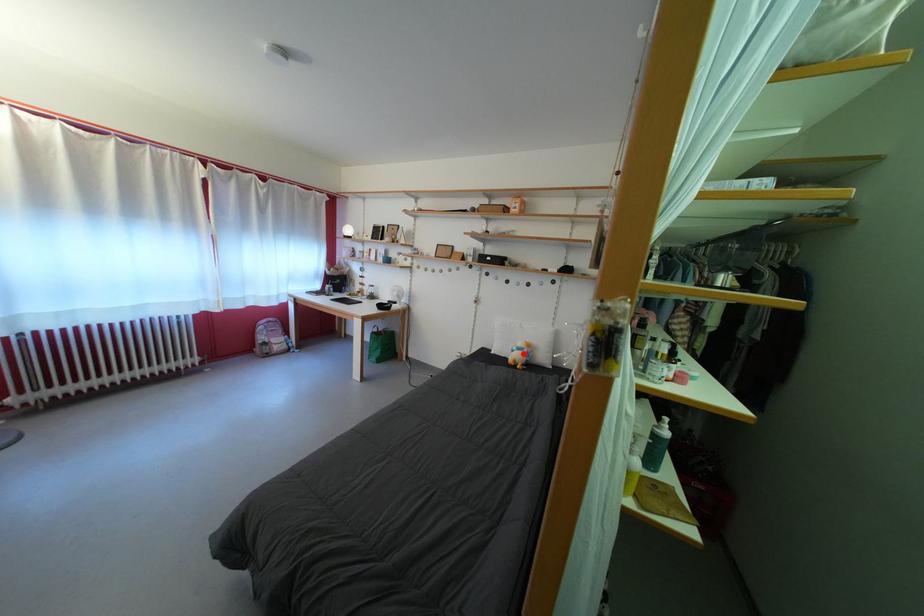
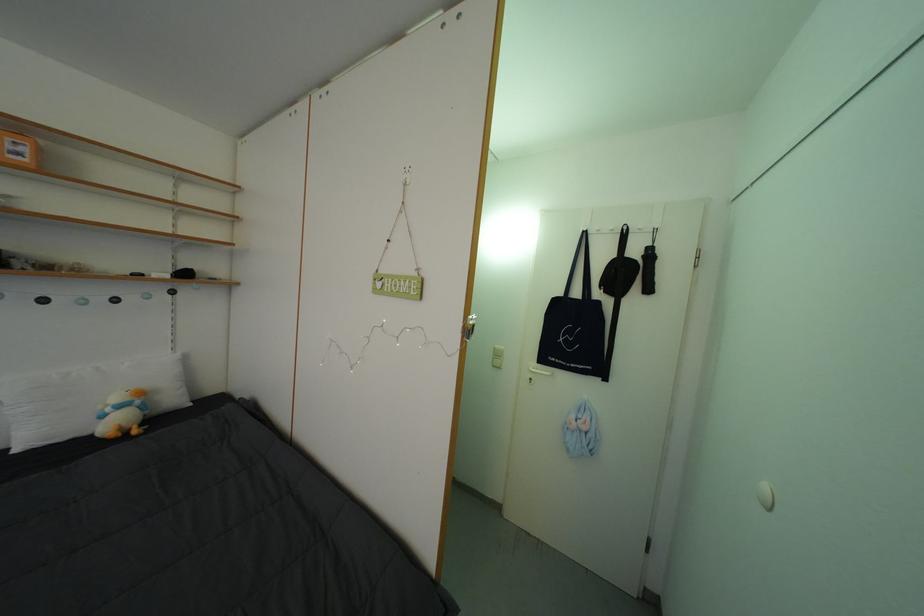
The point at the highlighted location is marked in the first image. Where is the corresponding point in the second image?

(117, 415)